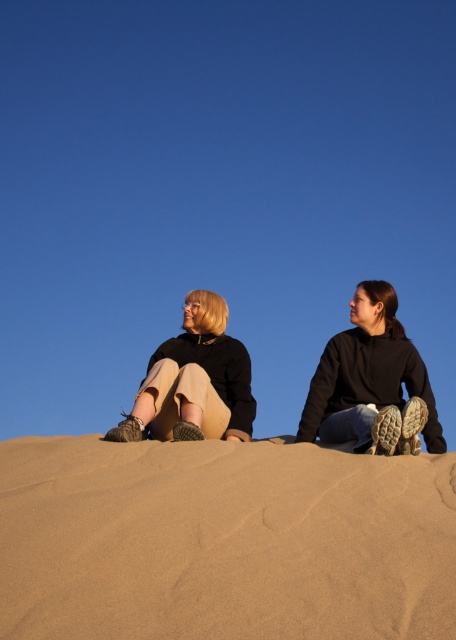
Question: From the image, what is the correct spatial relationship of brown sandy dunes at center in relation to black hoodie at upper right?

Choices:
 (A) right
 (B) left

Answer: (B)

Question: Is brown sandy dunes at center above black hoodie at upper right?

Choices:
 (A) no
 (B) yes

Answer: (A)

Question: Estimate the real-world distances between objects in this image. Which object is farther from the matte black jackets at center?

Choices:
 (A) brown sandy dunes at center
 (B) black hoodie at upper right
 (C) matte black sweater at center

Answer: (A)

Question: Which object is the farthest from the matte black jackets at center?

Choices:
 (A) black hoodie at upper right
 (B) brown sandy dunes at center
 (C) matte black sweater at center

Answer: (B)

Question: Which object appears closest to the camera in this image?

Choices:
 (A) matte black sweater at center
 (B) matte black jackets at center

Answer: (B)

Question: Does matte black jackets at center appear over black hoodie at upper right?

Choices:
 (A) no
 (B) yes

Answer: (B)